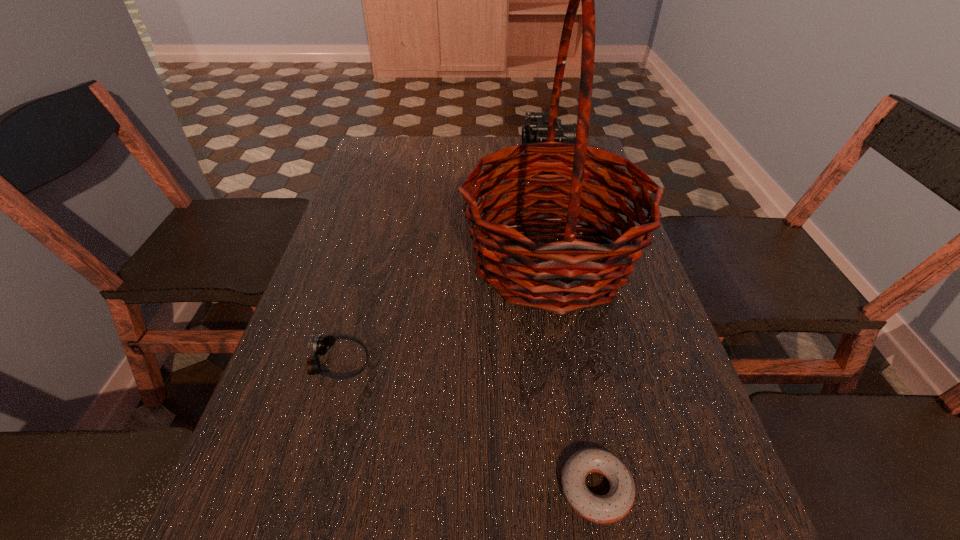
Find the location of a particular element. The image size is (960, 540). free location located through the lenses of the binoculars is located at coordinates (427, 158).

This screenshot has height=540, width=960. I want to click on free space located 0.210m through the lenses of the binoculars, so [458, 158].

Locate an element on the screen. vacant space located 0.400m through the lenses of the binoculars is located at coordinates (398, 158).

This screenshot has height=540, width=960. What are the coordinates of `free space located through the lenses of the leftmost object` in the screenshot? It's located at (460, 363).

Where is `vacant region located on the back of the nearest object`? The width and height of the screenshot is (960, 540). vacant region located on the back of the nearest object is located at coordinates (564, 322).

Image resolution: width=960 pixels, height=540 pixels. I want to click on object present at the far edge, so click(536, 131).

You are a GUI agent. You are given a task and a screenshot of the screen. Output one action in this format:
    pyautogui.click(x=<x>, y=<y>)
    Task: Click on the object present at the left edge
    The width and height of the screenshot is (960, 540).
    Given the screenshot: What is the action you would take?
    pyautogui.click(x=321, y=345)

Find the location of a particular element. basket situated at the right edge is located at coordinates pyautogui.click(x=546, y=276).

Locate an element on the screen. This screenshot has height=540, width=960. binoculars that is at the right edge is located at coordinates pyautogui.click(x=536, y=131).

This screenshot has width=960, height=540. What are the coordinates of `doughnut that is at the right edge` in the screenshot? It's located at (617, 503).